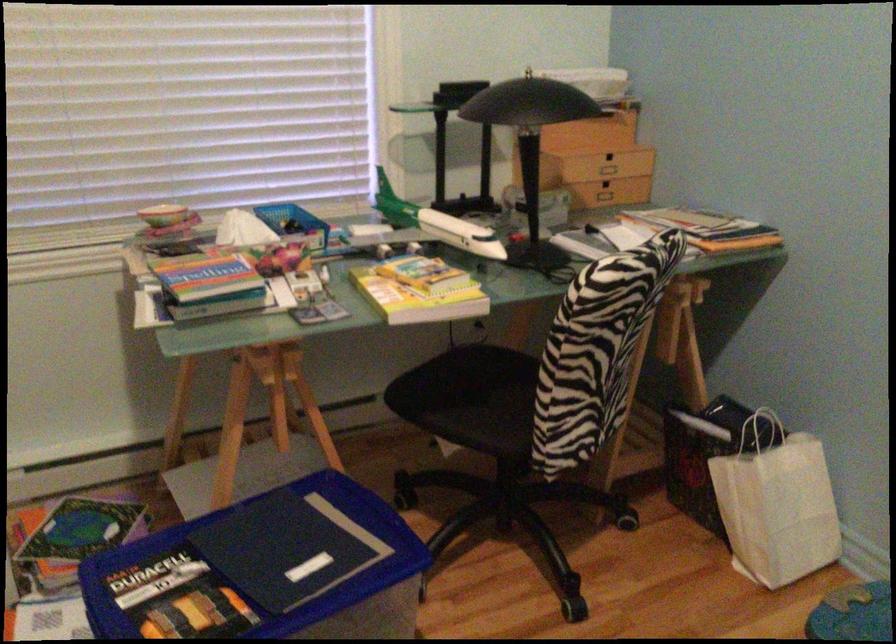
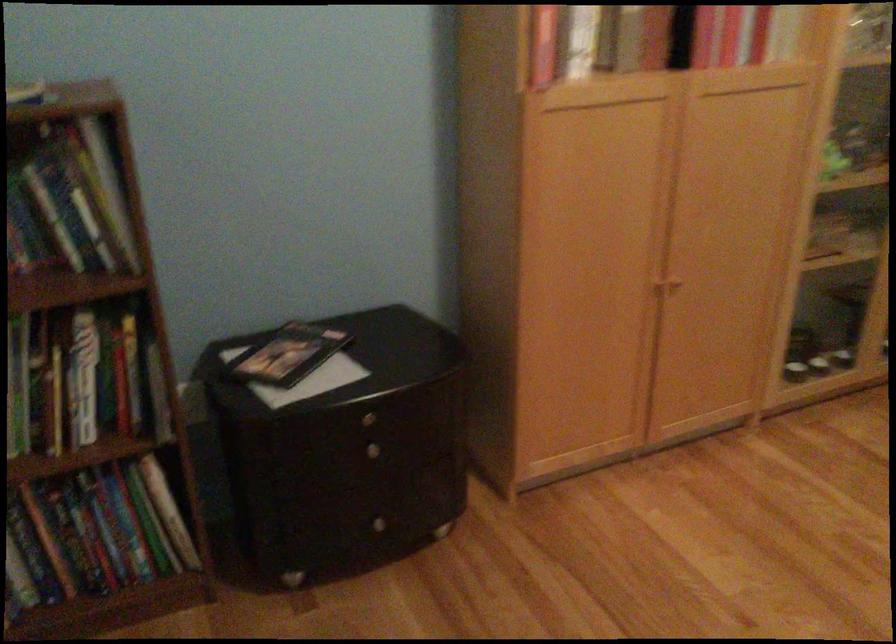
The images are taken continuously from a first-person perspective. In which direction is your viewpoint rotating?

The camera rotated toward left-down.